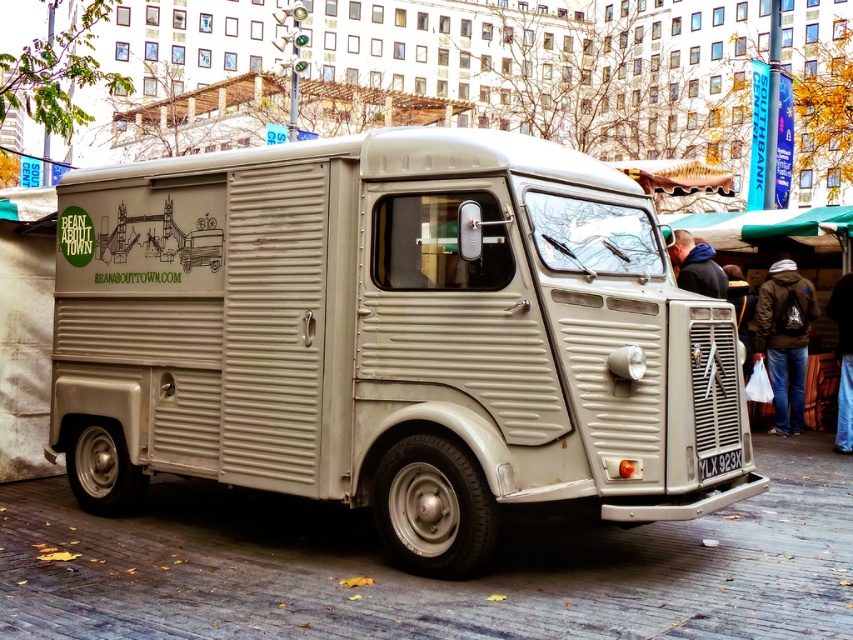
Does matte beige van at center appear over dark brown backpack at lower right?

Yes, matte beige van at center is above dark brown backpack at lower right.

Based on the photo, does matte beige van at center lie in front of dark brown backpack at lower right?

Yes, it is in front of dark brown backpack at lower right.

Does point (451, 364) come farther from viewer compared to point (807, 323)?

No, it is in front of (807, 323).

Where is `matte beige van at center`? This screenshot has width=853, height=640. matte beige van at center is located at coordinates 390,337.

Can you confirm if denim pants at lower right is taller than blue fleece jacket at upper right?

Correct, denim pants at lower right is much taller as blue fleece jacket at upper right.

Find the location of `denim pants at lower right`. denim pants at lower right is located at coordinates (843, 358).

Does matte beige van at center appear over denim pants at lower right?

Yes, matte beige van at center is above denim pants at lower right.

Is matte beige van at center to the right of denim pants at lower right from the viewer's perspective?

No, matte beige van at center is not to the right of denim pants at lower right.

Which is in front, point (346, 285) or point (848, 326)?

Positioned in front is point (346, 285).

Image resolution: width=853 pixels, height=640 pixels. I want to click on matte beige van at center, so click(x=390, y=337).